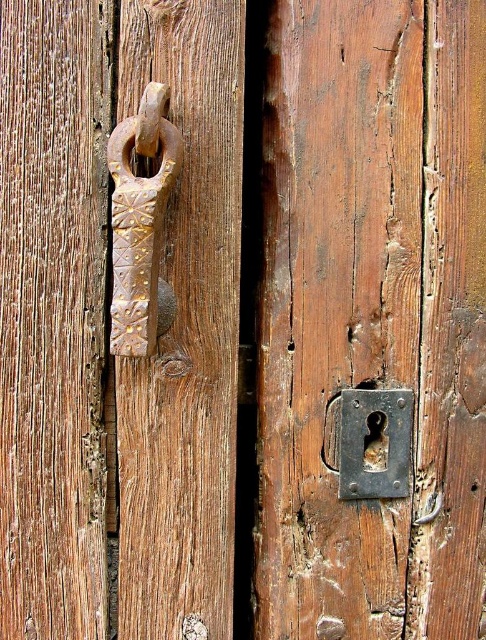
You are a maintenance worker holding a tool that requires you to reach 1 meter. You need to fix the rusty metal door handle at left. Can you reach it with your current tool?

The rusty metal door handle at left is 1.01 meters away from the viewer. Since the tool reaches only 1 meter, you cannot quite reach it and may need a longer tool or a step stool.

You are a locksmith examining the rusty metal door handle at left and the rusty metal keyhole at lower right. Which of these two objects has a greater width?

The rusty metal keyhole at lower right has a greater width than the rusty metal door handle at left.

You are a locksmith trying to install a new lock mechanism. The mechanism requires that the distance between the handle and keyhole must be exactly 12.59 inches. Given the current positions of the rusty metal door handle at left and rusty metal keyhole at lower right, will the mechanism fit properly?

The rusty metal door handle at left and rusty metal keyhole at lower right are already 12.59 inches apart from each other, so the mechanism will fit properly.